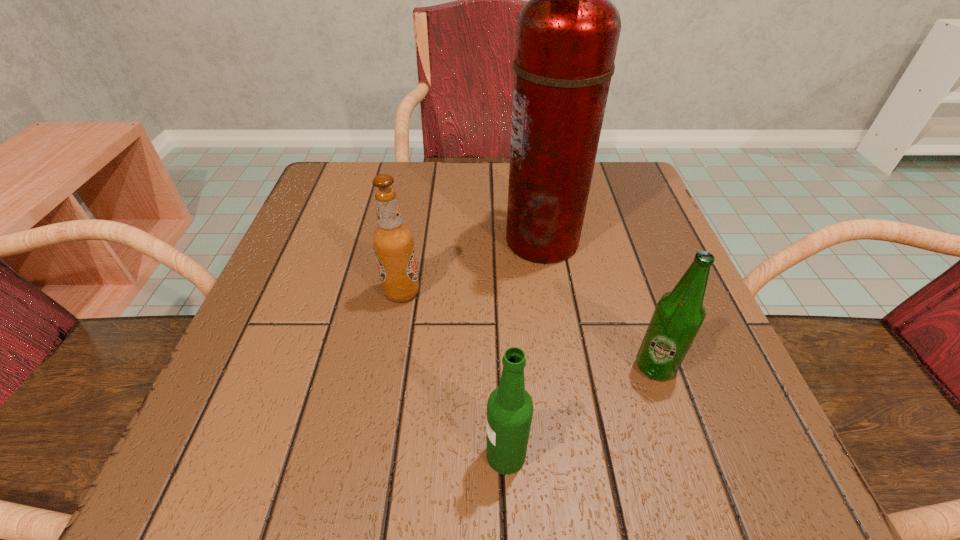
This screenshot has width=960, height=540. I want to click on the closest beer bottle to the second nearest object, so click(510, 407).

I want to click on vacant space that satisfies the following two spatial constraints: 1. on the label of the rightmost object; 2. on the label of the nearest object, so click(x=685, y=455).